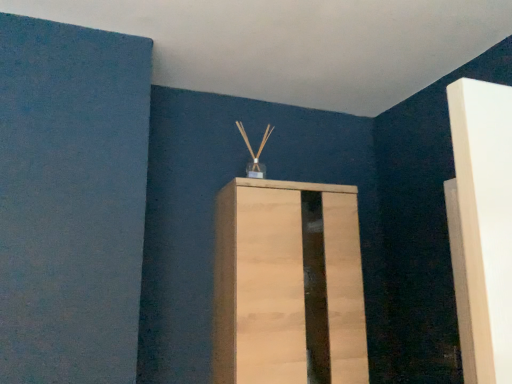
What do you see at coordinates (285, 284) in the screenshot? This screenshot has height=384, width=512. I see `light wood cabinet at center` at bounding box center [285, 284].

What is the approximate width of light wood cabinet at center?

light wood cabinet at center is 12.93 inches in width.

Find the location of `light wood cabinet at center`. light wood cabinet at center is located at coordinates (285, 284).

Image resolution: width=512 pixels, height=384 pixels. In order to click on light wood cabinet at center in this screenshot , I will do `click(285, 284)`.